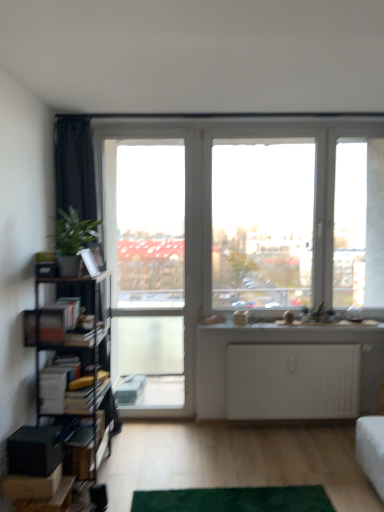
Question: Can you confirm if hardcover books at left, the second book positioned from the top, is smaller than hardcover books at left, marked as the 2th book in a bottom-to-top arrangement?

Choices:
 (A) yes
 (B) no

Answer: (A)

Question: Are hardcover books at left, the second book positioned from the top, and hardcover books at left, the 1th book when ordered from top to bottom, located far from each other?

Choices:
 (A) no
 (B) yes

Answer: (A)

Question: Does hardcover books at left, the first book when ordered from bottom to top, have a larger size compared to hardcover books at left, the 1th book when ordered from top to bottom?

Choices:
 (A) no
 (B) yes

Answer: (A)

Question: Is hardcover books at left, the first book when ordered from bottom to top, behind hardcover books at left, marked as the 2th book in a bottom-to-top arrangement?

Choices:
 (A) yes
 (B) no

Answer: (A)

Question: From the image's perspective, is hardcover books at left, the first book when ordered from bottom to top, located beneath hardcover books at left, marked as the 2th book in a bottom-to-top arrangement?

Choices:
 (A) no
 (B) yes

Answer: (B)

Question: Is hardcover books at left, the first book when ordered from bottom to top, positioned before hardcover books at left, marked as the 2th book in a bottom-to-top arrangement?

Choices:
 (A) no
 (B) yes

Answer: (A)

Question: Is green carpet at lower center located within hardcover books at left, marked as the 2th book in a bottom-to-top arrangement?

Choices:
 (A) yes
 (B) no

Answer: (B)

Question: Is hardcover books at left, the 1th book when ordered from top to bottom, positioned with its back to green carpet at lower center?

Choices:
 (A) no
 (B) yes

Answer: (A)

Question: Is hardcover books at left, the 1th book when ordered from top to bottom, facing towards green carpet at lower center?

Choices:
 (A) no
 (B) yes

Answer: (A)

Question: Can you confirm if hardcover books at left, the 1th book when ordered from top to bottom, is bigger than green carpet at lower center?

Choices:
 (A) yes
 (B) no

Answer: (A)

Question: Can you confirm if hardcover books at left, the 1th book when ordered from top to bottom, is thinner than green carpet at lower center?

Choices:
 (A) yes
 (B) no

Answer: (A)

Question: Is hardcover books at left, the 1th book when ordered from top to bottom, wider than green carpet at lower center?

Choices:
 (A) no
 (B) yes

Answer: (A)

Question: Is transparent glass window at center shorter than clear glass screen door at center?

Choices:
 (A) yes
 (B) no

Answer: (A)